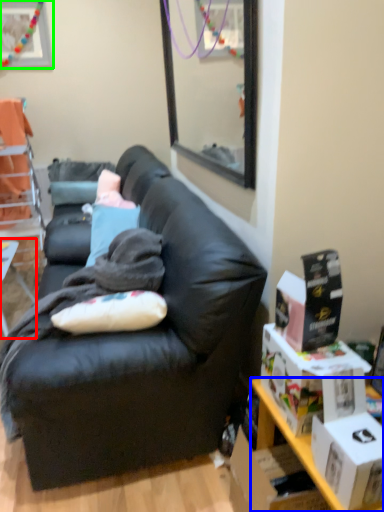
Question: Considering the real-world distances, which object is farthest from table (highlighted by a red box)? desk (highlighted by a blue box) or picture frame (highlighted by a green box)?

Choices:
 (A) desk
 (B) picture frame

Answer: (B)